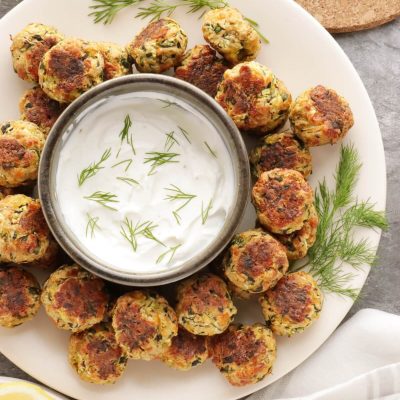
This screenshot has height=400, width=400. In order to click on napkin in this screenshot , I will do `click(361, 345)`.